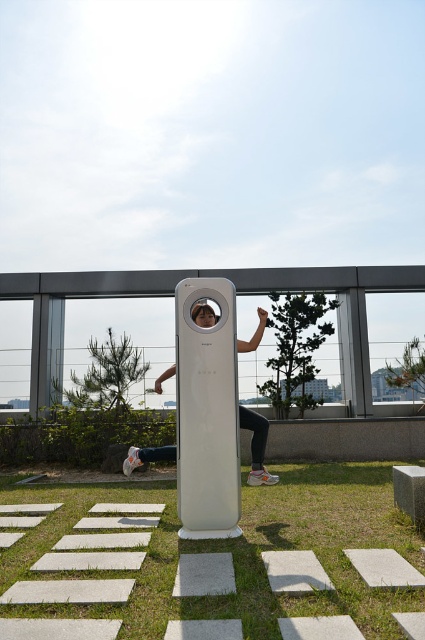
Describe the element at coordinates (212, 563) in the screenshot. I see `green grass at lower center` at that location.

Is point (47, 604) positioned after point (268, 426)?

No, (47, 604) is in front of (268, 426).

Identify the location of green grass at lower center. The height and width of the screenshot is (640, 425). (212, 563).